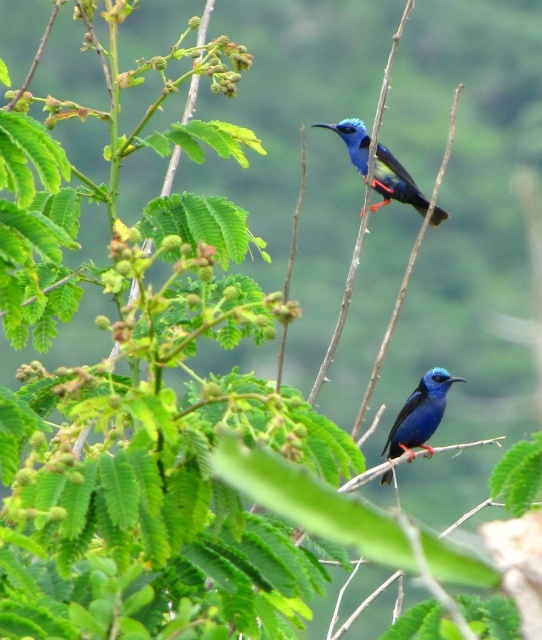
In the scene shown: You are an ornithologist observing two glossy blue birds in a tropical garden. You notice a glossy blue hummingbird at upper center and a glossy blue bird at center. Which of these two birds is positioned higher in the image?

The glossy blue hummingbird at upper center is positioned higher in the image than the glossy blue bird at center.

You are a birdwatcher trying to identify two birds in the image. The glossy blue hummingbird at upper center and the glossy blue bird at center are both present. Which of these two birds has a greater width?

The glossy blue hummingbird at upper center has a greater width than the glossy blue bird at center.